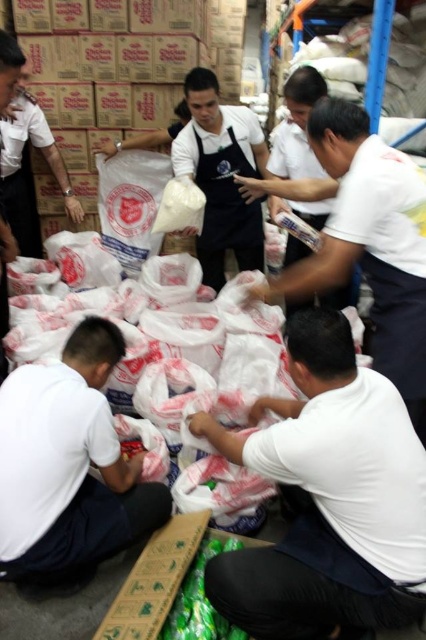
Question: Is the position of white matte plastic bag at upper center more distant than that of black matte apron at center?

Choices:
 (A) yes
 (B) no

Answer: (B)

Question: Can you confirm if white plastic bag at lower right is bigger than white matte plastic bag at upper center?

Choices:
 (A) no
 (B) yes

Answer: (A)

Question: Estimate the real-world distances between objects in this image. Which object is closer to the white plastic bag at lower right?

Choices:
 (A) white matte apron at center
 (B) white plastic bag at lower left
 (C) white matte plastic bag at upper center

Answer: (C)

Question: Estimate the real-world distances between objects in this image. Which object is closer to the white matte apron at center?

Choices:
 (A) white plastic bag at lower left
 (B) white plastic bag at lower right

Answer: (B)

Question: Which of the following is the closest to the observer?

Choices:
 (A) (325, 205)
 (B) (365, 433)
 (C) (42, 540)

Answer: (B)

Question: Does white plastic bag at lower right have a greater width compared to black matte apron at center?

Choices:
 (A) no
 (B) yes

Answer: (B)